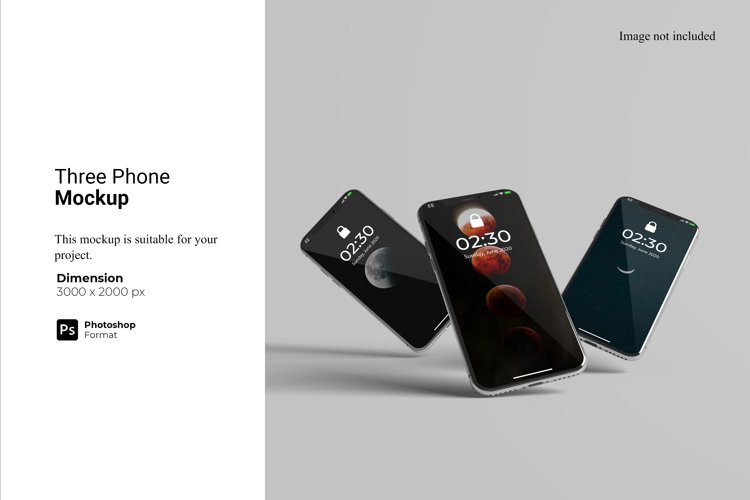
Where is `phone`? This screenshot has width=750, height=500. phone is located at coordinates (502, 297).